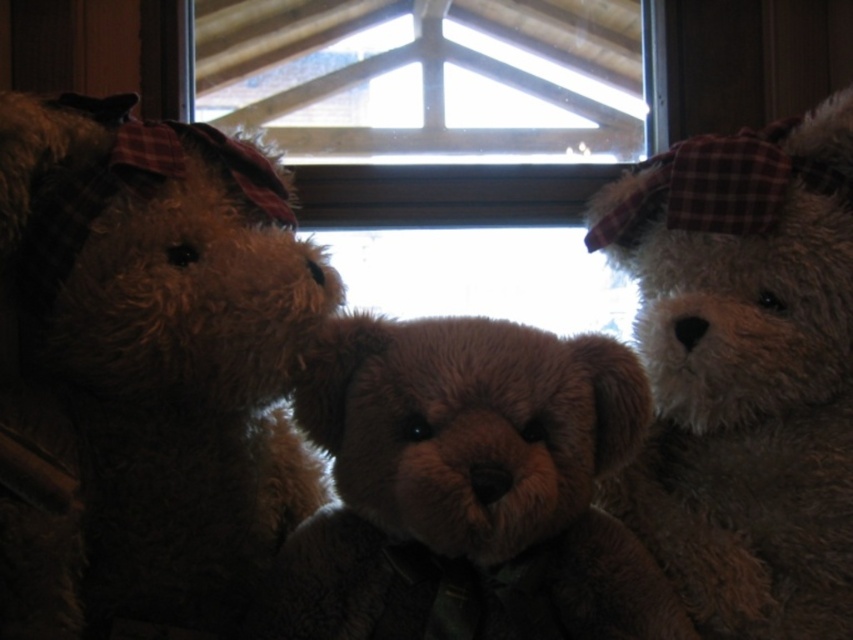
You are arranging a shelf and want to place the white plush bear at upper right and the brown plush teddy bear at center. Which one should you place first to ensure they are positioned correctly according to their current arrangement?

You should place the brown plush teddy bear at center first because the white plush bear at upper right is positioned on its right side, so placing the central teddy bear first allows you to position the white bear accordingly.

In the scene shown: You are standing in front of a group of three teddy bears arranged closely together. You notice a specific point marked at coordinates (146, 371). Which teddy bear is exactly at that location?

The brown plush teddy bear at left is located at point (146, 371).